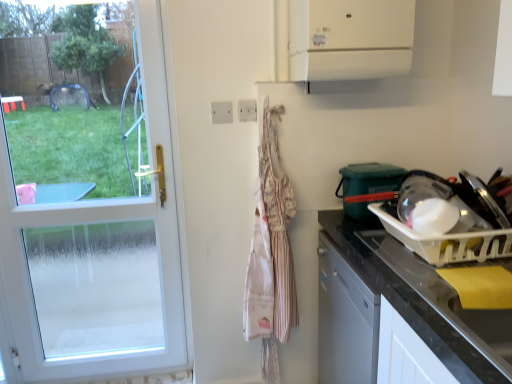
Question: Can you confirm if striped fabric apron at center is taller than black granite countertop at right?

Choices:
 (A) no
 (B) yes

Answer: (B)

Question: From a real-world perspective, is striped fabric apron at center beneath black granite countertop at right?

Choices:
 (A) no
 (B) yes

Answer: (A)

Question: Does striped fabric apron at center appear on the right side of black granite countertop at right?

Choices:
 (A) yes
 (B) no

Answer: (B)

Question: Considering the relative positions of striped fabric apron at center and black granite countertop at right in the image provided, is striped fabric apron at center behind black granite countertop at right?

Choices:
 (A) no
 (B) yes

Answer: (B)

Question: From the image's perspective, is striped fabric apron at center beneath black granite countertop at right?

Choices:
 (A) no
 (B) yes

Answer: (A)

Question: Considering the relative sizes of striped fabric apron at center and black granite countertop at right in the image provided, is striped fabric apron at center smaller than black granite countertop at right?

Choices:
 (A) yes
 (B) no

Answer: (A)

Question: From the image's perspective, is white glass door at left on top of white plastic dish rack at right, the first appliance when ordered from bottom to top?

Choices:
 (A) no
 (B) yes

Answer: (B)

Question: Are white glass door at left and white plastic dish rack at right, the first appliance when ordered from bottom to top, located far from each other?

Choices:
 (A) yes
 (B) no

Answer: (A)

Question: Is white glass door at left bigger than white plastic dish rack at right, the first appliance when ordered from bottom to top?

Choices:
 (A) yes
 (B) no

Answer: (A)

Question: Is white glass door at left next to white plastic dish rack at right, the first appliance when ordered from bottom to top, and touching it?

Choices:
 (A) no
 (B) yes

Answer: (A)

Question: Is white glass door at left turned away from white plastic dish rack at right, which ranks as the 2th appliance in top-to-bottom order?

Choices:
 (A) no
 (B) yes

Answer: (A)

Question: Is white glass door at left located outside white plastic dish rack at right, which ranks as the 2th appliance in top-to-bottom order?

Choices:
 (A) yes
 (B) no

Answer: (A)

Question: From a real-world perspective, does transparent plastic bowl at right, which is counted as the second appliance, starting from the bottom, sit lower than white plastic electric outlet at upper center, the first electric outlet viewed from the left?

Choices:
 (A) no
 (B) yes

Answer: (B)